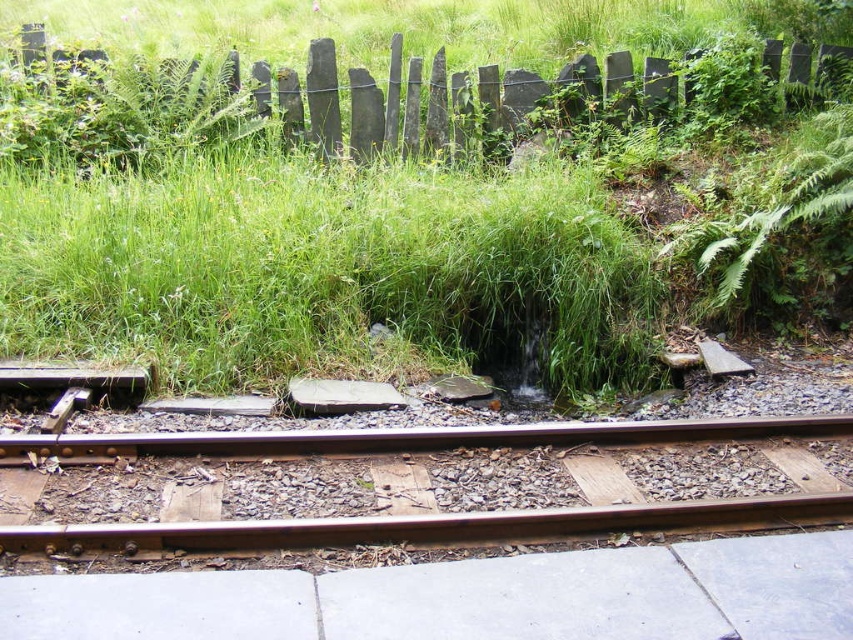
Does green grass at center appear on the right side of rusty metal fence at upper center?

No, green grass at center is not to the right of rusty metal fence at upper center.

Is point (28, 252) behind point (764, 51)?

That is False.

At what (x,y) coordinates should I click in order to perform the action: click on green grass at center. Please return your answer as a coordinate pair (x, y). The height and width of the screenshot is (640, 853). Looking at the image, I should click on (297, 243).

Can you confirm if green grass at center is positioned to the right of brown wooden train track at center?

In fact, green grass at center is to the left of brown wooden train track at center.

Is green grass at center bigger than brown wooden train track at center?

No, green grass at center is not bigger than brown wooden train track at center.

Between point (283, 220) and point (326, 444), which one is positioned in front?

Point (326, 444) is in front.

At what (x,y) coordinates should I click in order to perform the action: click on green grass at center. Please return your answer as a coordinate pair (x, y). The image size is (853, 640). Looking at the image, I should click on (297, 243).

Does point (811, 444) lie behind point (409, 90)?

No, it is not.

Can you confirm if brown wooden train track at center is positioned below rusty metal fence at upper center?

Indeed, brown wooden train track at center is positioned under rusty metal fence at upper center.

Is point (369, 508) positioned behind point (796, 58)?

No, (369, 508) is in front of (796, 58).

Identify the location of brown wooden train track at center. (440, 480).